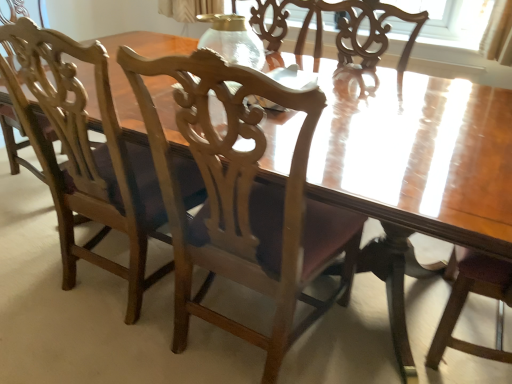
Question: Considering the relative sizes of wooden chair at center, the 2th chair from the left, and transparent glass vase at center in the image provided, is wooden chair at center, the 2th chair from the left, thinner than transparent glass vase at center?

Choices:
 (A) no
 (B) yes

Answer: (A)

Question: Is wooden chair at center, which ranks as the first chair in right-to-left order, at the right side of transparent glass vase at center?

Choices:
 (A) no
 (B) yes

Answer: (B)

Question: Can you confirm if wooden chair at center, the 2th chair from the left, is wider than transparent glass vase at center?

Choices:
 (A) yes
 (B) no

Answer: (A)

Question: From the image's perspective, would you say wooden chair at center, the 2th chair from the left, is positioned over transparent glass vase at center?

Choices:
 (A) yes
 (B) no

Answer: (B)

Question: Is wooden chair at center, the 2th chair from the left, completely or partially outside of transparent glass vase at center?

Choices:
 (A) no
 (B) yes

Answer: (B)

Question: Is wooden chair at center, the 2th chair from the left, behind transparent glass vase at center?

Choices:
 (A) no
 (B) yes

Answer: (A)

Question: Does transparent glass vase at center have a lesser height compared to wooden chair at left, placed as the 2th chair when sorted from right to left?

Choices:
 (A) yes
 (B) no

Answer: (A)

Question: Does transparent glass vase at center touch wooden chair at left, placed as the 2th chair when sorted from right to left?

Choices:
 (A) yes
 (B) no

Answer: (B)

Question: Does transparent glass vase at center have a larger size compared to wooden chair at left, which is the 1th chair in left-to-right order?

Choices:
 (A) no
 (B) yes

Answer: (A)

Question: Is transparent glass vase at center located outside wooden chair at left, which is the 1th chair in left-to-right order?

Choices:
 (A) no
 (B) yes

Answer: (B)

Question: Is transparent glass vase at center further to camera compared to wooden chair at left, placed as the 2th chair when sorted from right to left?

Choices:
 (A) no
 (B) yes

Answer: (B)

Question: From the image's perspective, is transparent glass vase at center below wooden chair at left, which is the 1th chair in left-to-right order?

Choices:
 (A) no
 (B) yes

Answer: (A)

Question: Is transparent glass vase at center looking in the opposite direction of wooden chair at center, the 2th chair from the left?

Choices:
 (A) no
 (B) yes

Answer: (A)